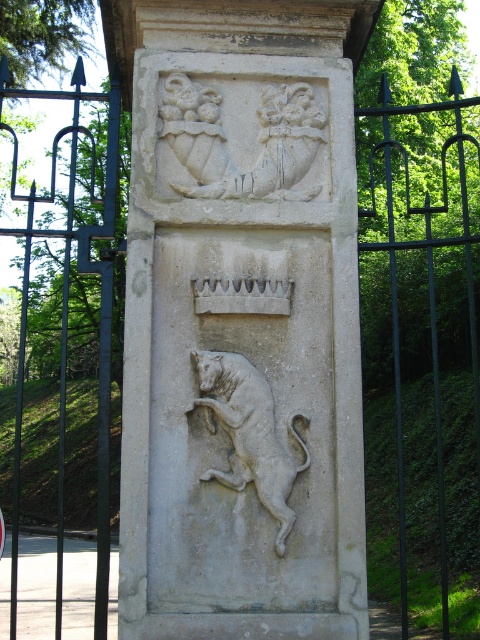
Question: Can you confirm if white stone coat of arms at upper center is positioned to the right of white stone lion at center?

Choices:
 (A) yes
 (B) no

Answer: (B)

Question: Which point is closer to the camera?

Choices:
 (A) (288, 467)
 (B) (172, 184)

Answer: (A)

Question: Is white stone coat of arms at upper center bigger than white stone lion at center?

Choices:
 (A) yes
 (B) no

Answer: (A)

Question: Does white stone coat of arms at upper center lie in front of white stone lion at center?

Choices:
 (A) no
 (B) yes

Answer: (A)

Question: Which object is farther from the camera taking this photo?

Choices:
 (A) white stone lion at center
 (B) white stone coat of arms at upper center

Answer: (B)